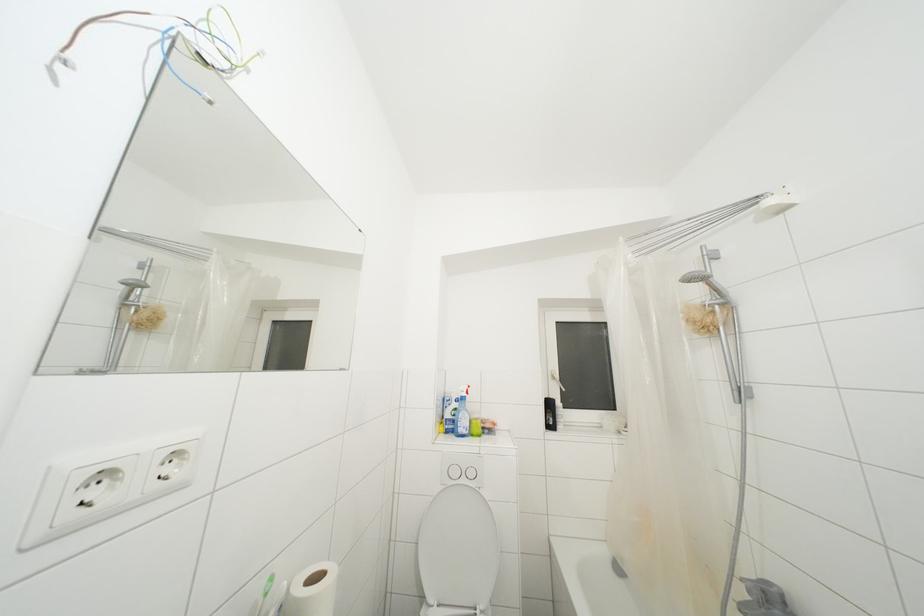
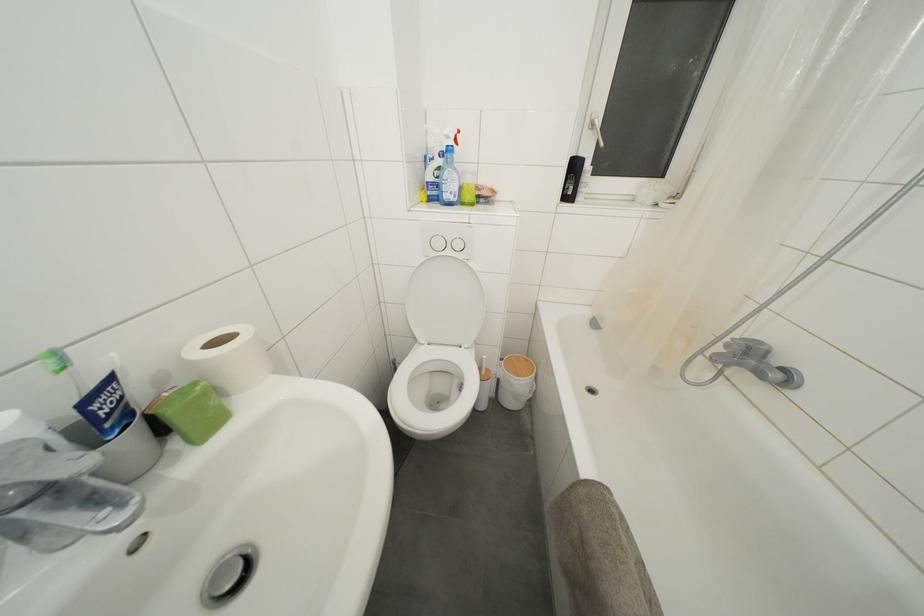
Locate, in the second image, the point that corresponds to the point at 476,477 in the first image.

(463, 251)